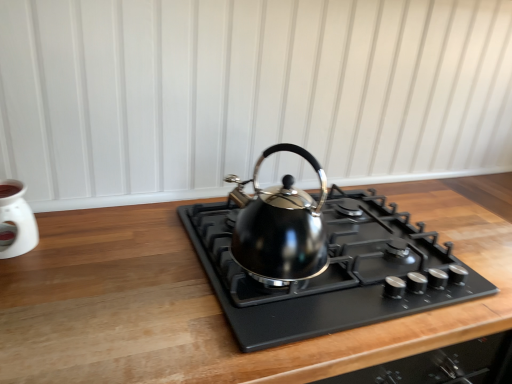
This screenshot has height=384, width=512. What do you see at coordinates (16, 220) in the screenshot? I see `white glossy oil burner at left` at bounding box center [16, 220].

The height and width of the screenshot is (384, 512). What are the coordinates of `black metallic kettle at center` in the screenshot? It's located at (280, 227).

Considering the points (253, 209) and (20, 253), which point is behind, point (253, 209) or point (20, 253)?

Positioned behind is point (20, 253).

From a real-world perspective, is black metallic kettle at center above or below white glossy oil burner at left?

Clearly, from a real-world perspective, black metallic kettle at center is above white glossy oil burner at left.

Can you confirm if black metallic kettle at center is shorter than white glossy oil burner at left?

Incorrect, the height of black metallic kettle at center does not fall short of that of white glossy oil burner at left.

From the image's perspective, is black metallic kettle at center located above white glossy oil burner at left?

Yes, from the image's perspective, black metallic kettle at center is over white glossy oil burner at left.

Looking at the image, does black matte gas stove at center seem bigger or smaller compared to white glossy oil burner at left?

Considering their sizes, black matte gas stove at center takes up more space than white glossy oil burner at left.

Is black matte gas stove at center located outside white glossy oil burner at left?

Absolutely, black matte gas stove at center is external to white glossy oil burner at left.

Is point (438, 258) positioned after point (5, 257)?

Yes, it is behind point (5, 257).

Is black matte gas stove at center wider than white glossy oil burner at left?

Yes, black matte gas stove at center is wider than white glossy oil burner at left.

From a real-world perspective, between white glossy oil burner at left and black metallic kettle at center, who is vertically lower?

white glossy oil burner at left is physically lower.

Is white glossy oil burner at left far from black metallic kettle at center?

No, white glossy oil burner at left is in close proximity to black metallic kettle at center.

Consider the image. Considering the sizes of objects white glossy oil burner at left and black metallic kettle at center in the image provided, who is taller, white glossy oil burner at left or black metallic kettle at center?

black metallic kettle at center is taller.

Is black metallic kettle at center at the back of white glossy oil burner at left?

No, black metallic kettle at center is not at the back of white glossy oil burner at left.

Is white glossy oil burner at left not near black matte gas stove at center?

No, there isn't a large distance between white glossy oil burner at left and black matte gas stove at center.

From a real-world perspective, between white glossy oil burner at left and black matte gas stove at center, who is vertically lower?

black matte gas stove at center, from a real-world perspective.

Is white glossy oil burner at left to the right of black matte gas stove at center from the viewer's perspective?

Incorrect, white glossy oil burner at left is not on the right side of black matte gas stove at center.

Is white glossy oil burner at left taller or shorter than black matte gas stove at center?

In the image, white glossy oil burner at left appears to be taller than black matte gas stove at center.

Can you confirm if black metallic kettle at center is smaller than black matte gas stove at center?

Yes, black metallic kettle at center is smaller than black matte gas stove at center.

From a real-world perspective, is black metallic kettle at center on black matte gas stove at center?

Indeed, from a real-world perspective, black metallic kettle at center stands above black matte gas stove at center.

Is black metallic kettle at center taller or shorter than black matte gas stove at center?

Considering their sizes, black metallic kettle at center has more height than black matte gas stove at center.

Consider the image. From the image's perspective, which one is positioned lower, black metallic kettle at center or black matte gas stove at center?

black matte gas stove at center appears lower in the image.

Can you confirm if black matte gas stove at center is positioned to the right of black metallic kettle at center?

Indeed, black matte gas stove at center is positioned on the right side of black metallic kettle at center.

Is black matte gas stove at center inside or outside of black metallic kettle at center?

black matte gas stove at center exists outside the volume of black metallic kettle at center.

Who is more distant, black matte gas stove at center or black metallic kettle at center?

Positioned behind is black metallic kettle at center.

What's the angular difference between black matte gas stove at center and black metallic kettle at center's facing directions?

5.47 degrees separate the facing orientations of black matte gas stove at center and black metallic kettle at center.

The width and height of the screenshot is (512, 384). I want to click on kettle on the right side of white glossy oil burner at left, so click(x=280, y=227).

Image resolution: width=512 pixels, height=384 pixels. What are the coordinates of `appliance that is behind the black matte gas stove at center` in the screenshot? It's located at (16, 220).

Looking at the image, which one is located closer to white glossy oil burner at left, black matte gas stove at center or black metallic kettle at center?

Based on the image, black metallic kettle at center appears to be nearer to white glossy oil burner at left.

When comparing their distances from black metallic kettle at center, does white glossy oil burner at left or black matte gas stove at center seem closer?

Based on the image, black matte gas stove at center appears to be nearer to black metallic kettle at center.

Looking at the image, which one is located closer to black metallic kettle at center, black matte gas stove at center or white glossy oil burner at left?

black matte gas stove at center.

Looking at the image, which one is located closer to white glossy oil burner at left, black metallic kettle at center or black matte gas stove at center?

The object closer to white glossy oil burner at left is black metallic kettle at center.

Estimate the real-world distances between objects in this image. Which object is closer to black matte gas stove at center, black metallic kettle at center or white glossy oil burner at left?

black metallic kettle at center lies closer to black matte gas stove at center than the other object.

Looking at the image, which one is located further to black matte gas stove at center, white glossy oil burner at left or black metallic kettle at center?

The object further to black matte gas stove at center is white glossy oil burner at left.

Find the location of a particular element. kettle between white glossy oil burner at left and black matte gas stove at center in the horizontal direction is located at coordinates (280, 227).